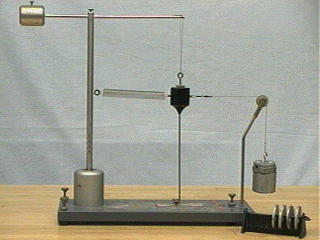
Find the location of a particular element. sheet is located at coordinates (234, 69).